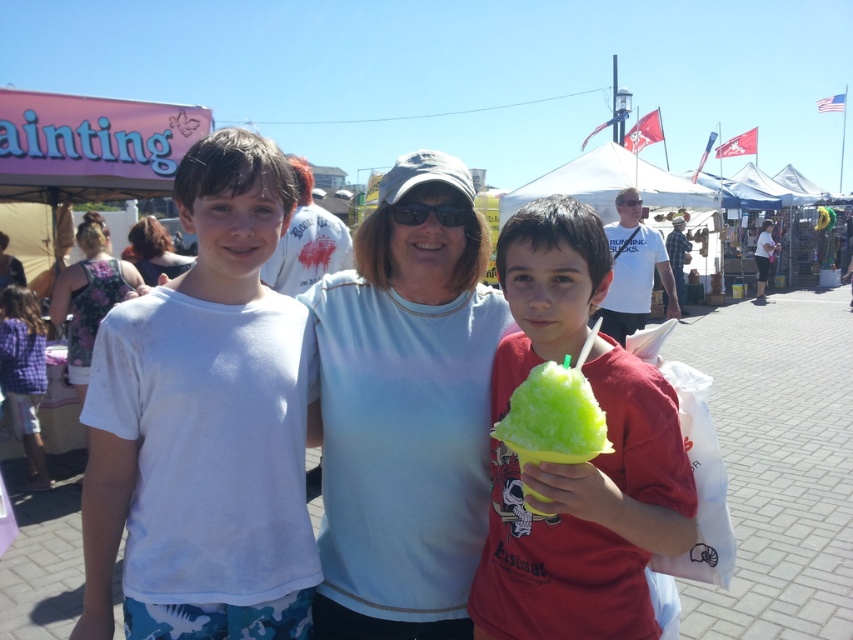
You are at a fair and want to buy a souvenir. You see a light blue fabric at center and black plastic sunglasses at center. Which item is located more to the left?

The light blue fabric at center is more to the left than the black plastic sunglasses at center.

You are taking a photo of the purple checkered shirt at left and the black plastic sunglasses at center. Which object should you zoom in on to ensure both fit in the frame?

You should zoom in on the black plastic sunglasses at center because the purple checkered shirt at left is bigger than the black plastic sunglasses at center, so zooming in on the smaller object will allow both to fit in the frame.

You are a photographer trying to capture a photo of the light blue fabric at center and the purple checkered shirt at left. Since you want to highlight both in the frame, which object should you focus on first to ensure proper exposure, considering their sizes?

The light blue fabric at center should be focused on first because it is bigger than the purple checkered shirt at left, so it will require more attention to capture its details properly.